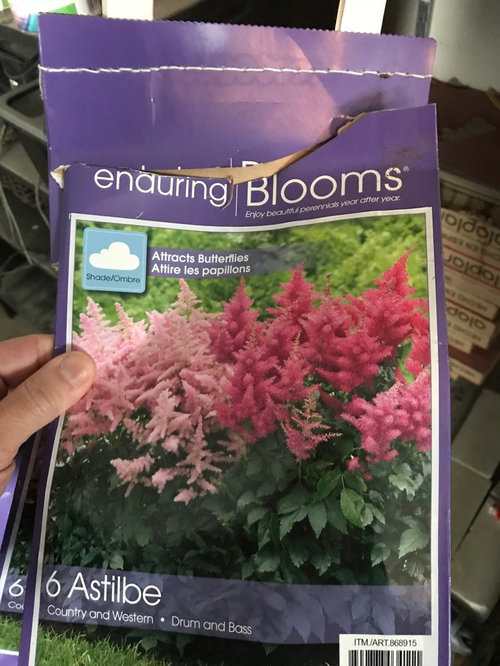
Where is `white wall`? The width and height of the screenshot is (500, 666). white wall is located at coordinates (466, 19).